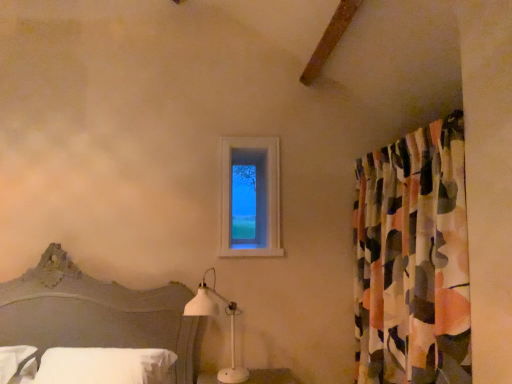
Question: Is clear glass window at upper center facing away from abstract fabric curtain at right?

Choices:
 (A) yes
 (B) no

Answer: (B)

Question: From a real-world perspective, is clear glass window at upper center below abstract fabric curtain at right?

Choices:
 (A) no
 (B) yes

Answer: (A)

Question: Are clear glass window at upper center and abstract fabric curtain at right beside each other?

Choices:
 (A) yes
 (B) no

Answer: (B)

Question: Can you confirm if clear glass window at upper center is shorter than abstract fabric curtain at right?

Choices:
 (A) no
 (B) yes

Answer: (B)

Question: Does clear glass window at upper center have a lesser width compared to abstract fabric curtain at right?

Choices:
 (A) yes
 (B) no

Answer: (A)

Question: Is the depth of clear glass window at upper center greater than that of abstract fabric curtain at right?

Choices:
 (A) no
 (B) yes

Answer: (B)

Question: From a real-world perspective, is white matte table lamp at lower center on top of white soft pillow at lower left?

Choices:
 (A) yes
 (B) no

Answer: (A)

Question: Could you tell me if white matte table lamp at lower center is facing white soft pillow at lower left?

Choices:
 (A) yes
 (B) no

Answer: (B)

Question: From the image's perspective, is white matte table lamp at lower center located above white soft pillow at lower left?

Choices:
 (A) no
 (B) yes

Answer: (B)

Question: Is white matte table lamp at lower center outside of white soft pillow at lower left?

Choices:
 (A) no
 (B) yes

Answer: (B)

Question: Is white matte table lamp at lower center taller than white soft pillow at lower left?

Choices:
 (A) yes
 (B) no

Answer: (A)

Question: Is white matte table lamp at lower center far from white soft pillow at lower left?

Choices:
 (A) no
 (B) yes

Answer: (A)

Question: Is white soft pillow at lower left not near white matte table lamp at lower center?

Choices:
 (A) no
 (B) yes

Answer: (A)